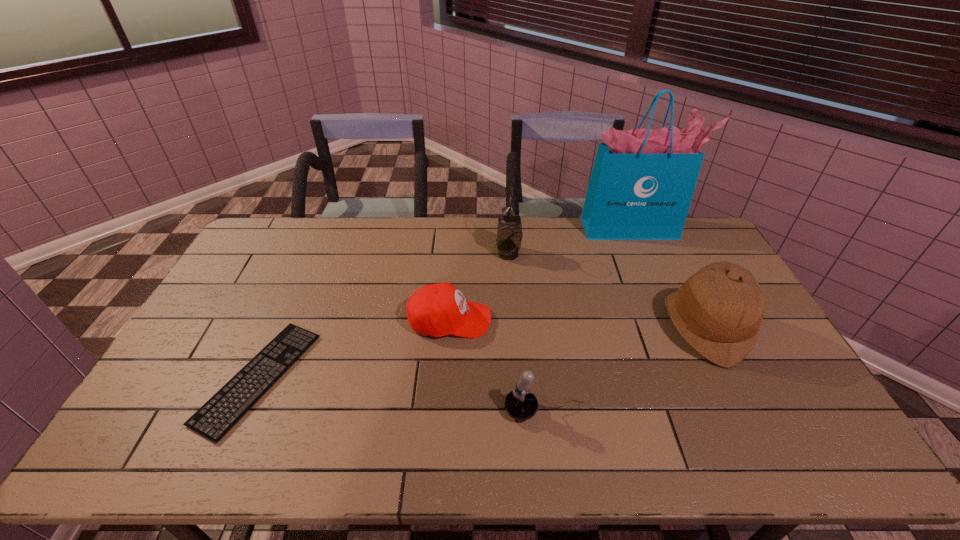
Locate an element on the screen. The height and width of the screenshot is (540, 960). free point between the second object from left to right and the farthest object is located at coordinates tap(541, 274).

The width and height of the screenshot is (960, 540). I want to click on vacant space that's between the second farthest object and the shortest object, so click(384, 316).

At what (x,y) coordinates should I click in order to perform the action: click on vacant point located between the microphone and the hat. Please return your answer as a coordinate pair (x, y). The width and height of the screenshot is (960, 540). Looking at the image, I should click on (625, 368).

At what (x,y) coordinates should I click in order to perform the action: click on free space between the hat and the tallest object. Please return your answer as a coordinate pair (x, y). Image resolution: width=960 pixels, height=540 pixels. Looking at the image, I should click on (669, 278).

You are a GUI agent. You are given a task and a screenshot of the screen. Output one action in this format:
    pyautogui.click(x=<x>, y=<y>)
    Task: Click on the empty location between the hat and the third shortest object
    The height and width of the screenshot is (540, 960).
    Given the screenshot: What is the action you would take?
    pyautogui.click(x=625, y=368)

At what (x,y) coordinates should I click in order to perform the action: click on free space between the farthest object and the fourth tallest object. Please return your answer as a coordinate pair (x, y). The image size is (960, 540). Looking at the image, I should click on (588, 319).

Identify the location of vacant region between the hat and the third shortest object. (625, 368).

I want to click on empty space that is in between the leftmost object and the oil lamp, so click(384, 316).

At what (x,y) coordinates should I click in order to perform the action: click on vacant area that lies between the tallest object and the hat. Please return your answer as a coordinate pair (x, y). The width and height of the screenshot is (960, 540). Looking at the image, I should click on (669, 278).

The height and width of the screenshot is (540, 960). Identify the location of object that is the fifth nearest to the microphone. (642, 182).